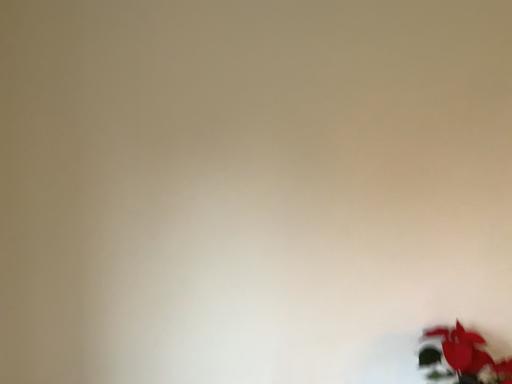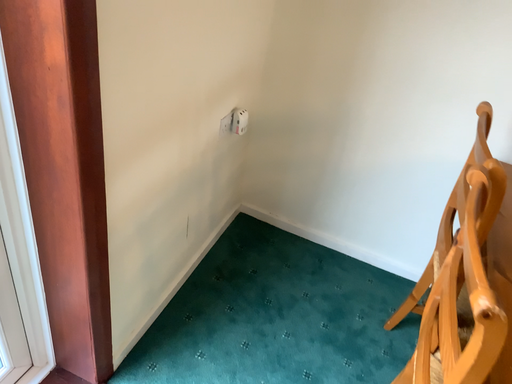
Question: Which way did the camera rotate in the video?

Choices:
 (A) rotated right
 (B) rotated left

Answer: (B)